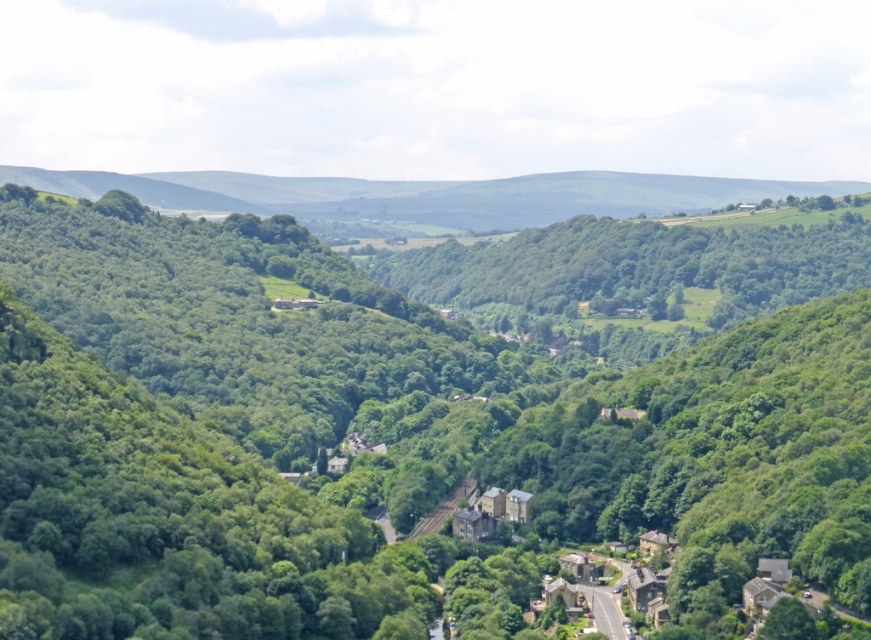
You are standing at the valley overlook and want to take a photo of both the green leafy tree at center and the green grassy hillside at upper center. Which object should you focus on first to ensure both are in the frame?

You should focus on the green leafy tree at center first because it is in front of the green grassy hillside at upper center, so adjusting the camera to include the closer tree will naturally include the background hillside as well.

You are standing at the vantage point overlooking the valley. You notice a green leafy tree at center. Can you determine its exact position relative to the valley using coordinates?

The green leafy tree at center is located at point coordinates of 0.677 on the x axis and 0.444 on the y axis.